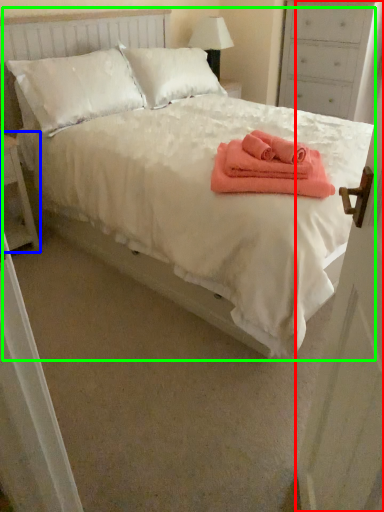
Question: Which object is the farthest from door (highlighted by a red box)? Choose among these: nightstand (highlighted by a blue box) or bed (highlighted by a green box).

Choices:
 (A) nightstand
 (B) bed

Answer: (A)